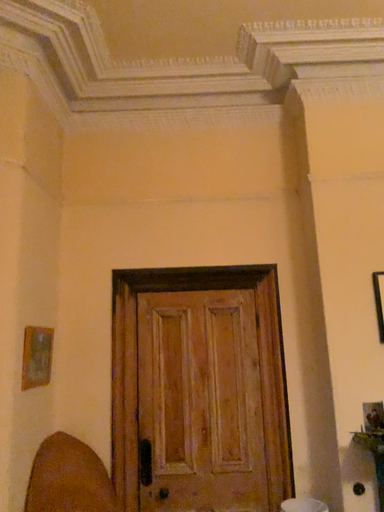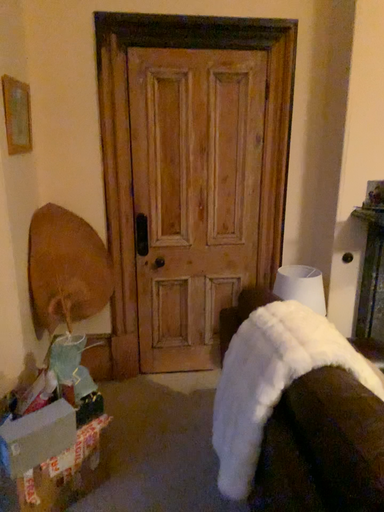
Question: How did the camera likely rotate when shooting the video?

Choices:
 (A) rotated downward
 (B) rotated upward

Answer: (A)